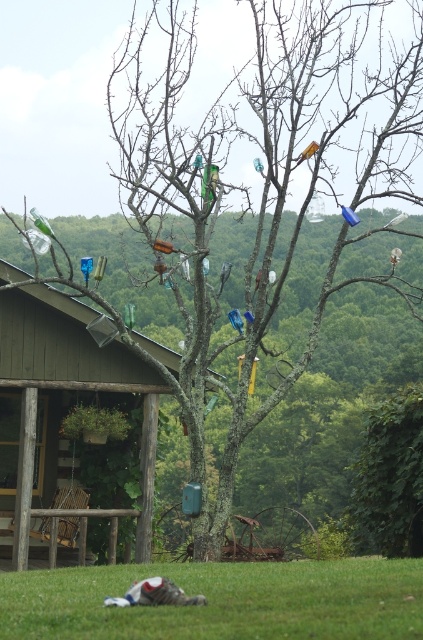
Is green grass at lower center closer to camera compared to wooden porch swing at left?

Yes.

Does green grass at lower center have a lesser width compared to wooden porch swing at left?

In fact, green grass at lower center might be wider than wooden porch swing at left.

Find the location of a particular element. green grass at lower center is located at coordinates (222, 602).